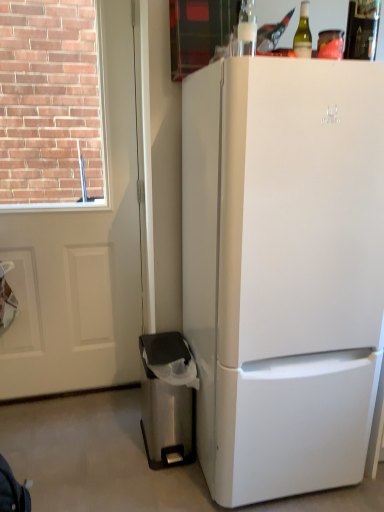
Question: From a real-world perspective, is stainless steel trash can at lower left located beneath white matte screen door at left?

Choices:
 (A) yes
 (B) no

Answer: (A)

Question: Can white matte screen door at left be found inside stainless steel trash can at lower left?

Choices:
 (A) yes
 (B) no

Answer: (B)

Question: Is stainless steel trash can at lower left oriented towards white matte screen door at left?

Choices:
 (A) yes
 (B) no

Answer: (B)

Question: Is stainless steel trash can at lower left touching white matte screen door at left?

Choices:
 (A) no
 (B) yes

Answer: (A)

Question: From a real-world perspective, is stainless steel trash can at lower left positioned over white matte screen door at left based on gravity?

Choices:
 (A) no
 (B) yes

Answer: (A)

Question: Is white matte refrigerator at right inside the boundaries of stainless steel trash can at lower left, or outside?

Choices:
 (A) inside
 (B) outside

Answer: (B)

Question: Considering the positions of white matte refrigerator at right and stainless steel trash can at lower left in the image, is white matte refrigerator at right bigger or smaller than stainless steel trash can at lower left?

Choices:
 (A) small
 (B) big

Answer: (B)

Question: From the image's perspective, is white matte refrigerator at right located above or below stainless steel trash can at lower left?

Choices:
 (A) above
 (B) below

Answer: (A)

Question: Does point (354, 130) appear closer or farther from the camera than point (175, 376)?

Choices:
 (A) closer
 (B) farther

Answer: (A)

Question: Is white matte refrigerator at right spatially inside green glass bottle at upper center, arranged as the 1th bottle when viewed from the left, or outside of it?

Choices:
 (A) outside
 (B) inside

Answer: (A)

Question: Is point (321, 330) positioned closer to the camera than point (306, 47)?

Choices:
 (A) farther
 (B) closer

Answer: (A)

Question: From the image's perspective, relative to green glass bottle at upper center, arranged as the 1th bottle when viewed from the left, is white matte refrigerator at right above or below?

Choices:
 (A) above
 (B) below

Answer: (B)

Question: Is white matte refrigerator at right in front of or behind green glass bottle at upper center, arranged as the 1th bottle when viewed from the left, in the image?

Choices:
 (A) front
 (B) behind

Answer: (A)

Question: Considering their positions, is stainless steel trash can at lower left located in front of or behind white matte screen door at left?

Choices:
 (A) front
 (B) behind

Answer: (A)

Question: Looking at the image, does stainless steel trash can at lower left seem bigger or smaller compared to white matte screen door at left?

Choices:
 (A) big
 (B) small

Answer: (B)